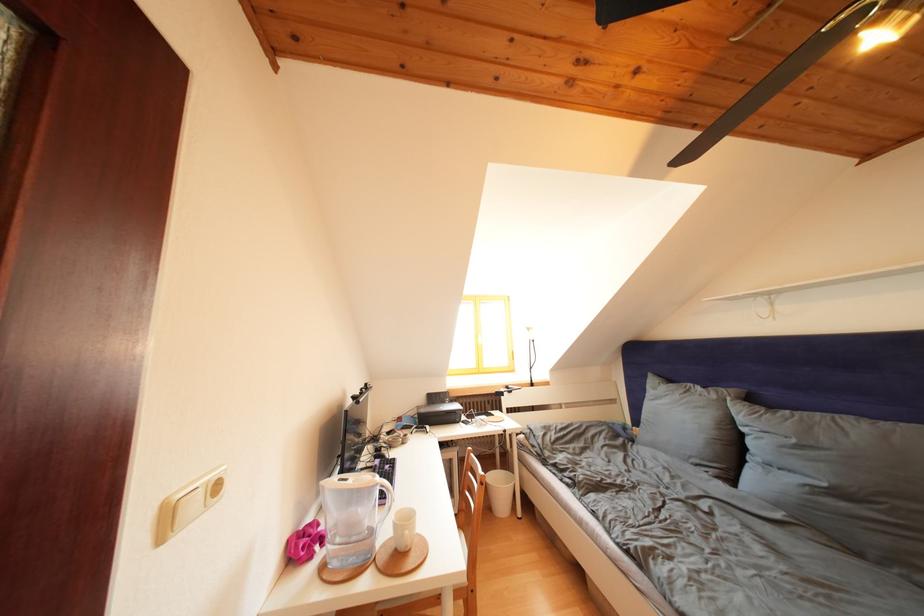
Where would you push the light switch button? Please return your answer as a coordinate pair (x, y).

(188, 504)